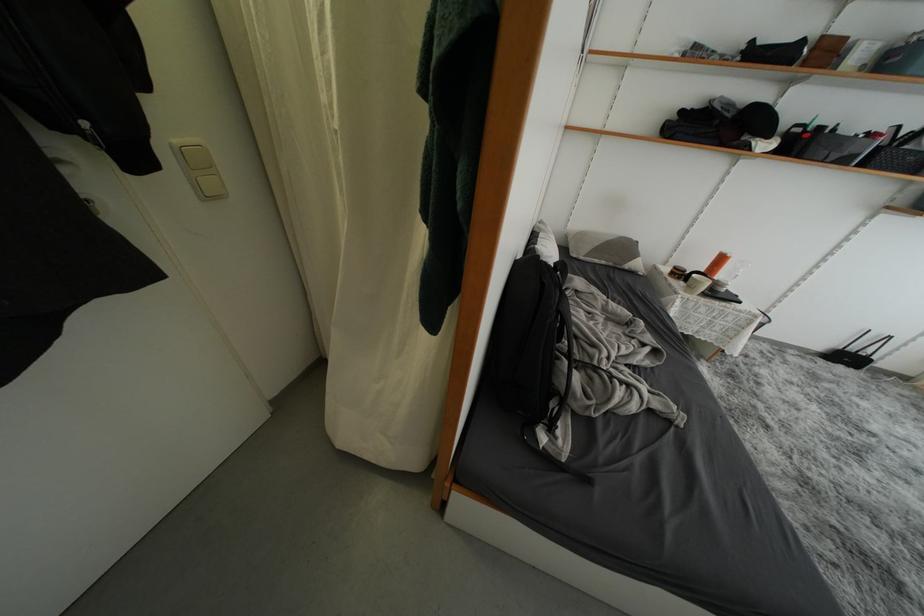
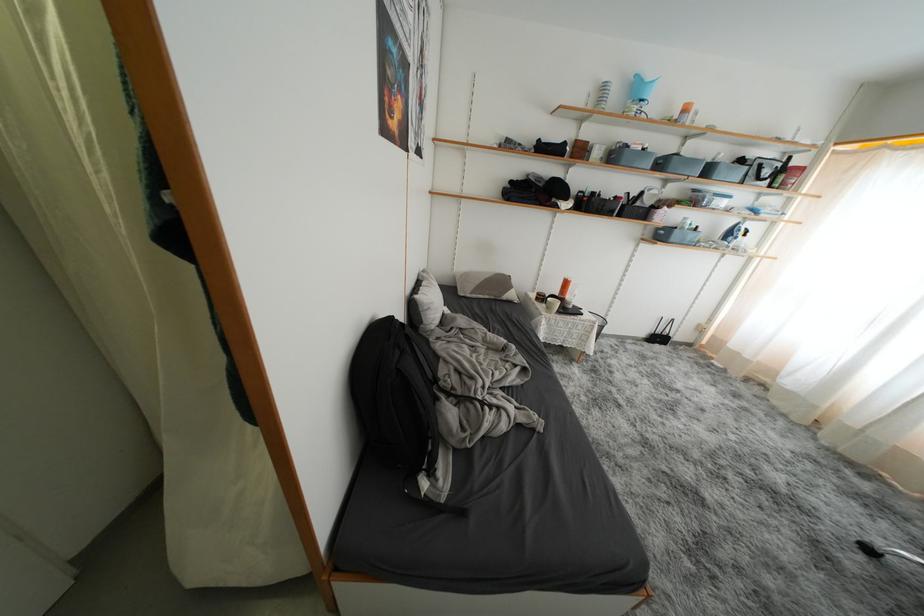
Find the pixel in the second image that matches point (631, 252) in the first image.

(508, 286)